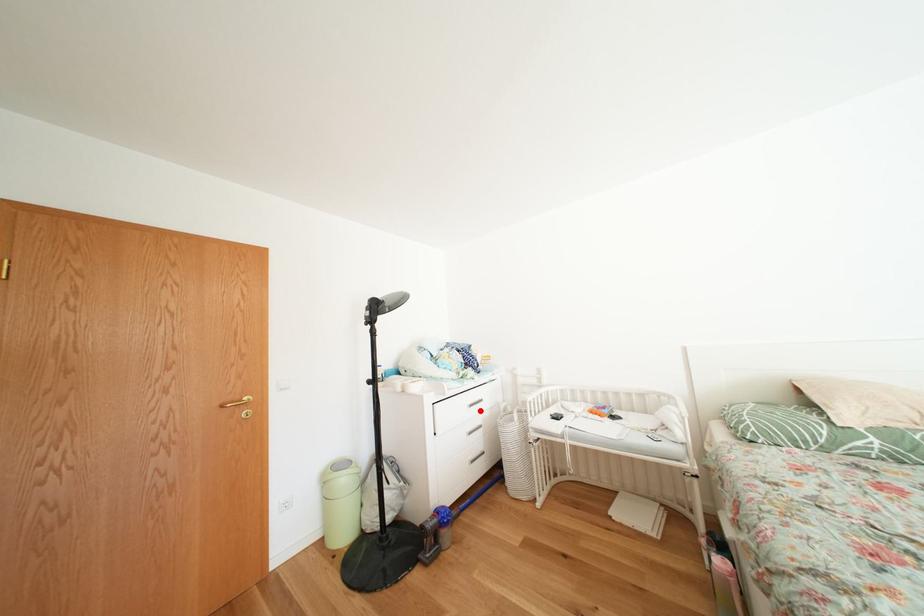
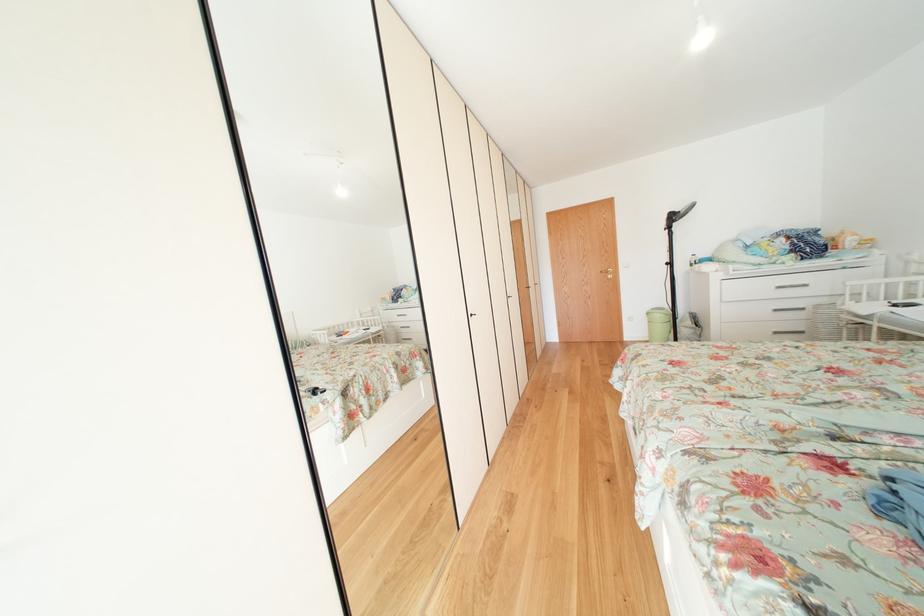
Where in the second image is the point corresponding to the highlighted location from the first image?

(787, 292)